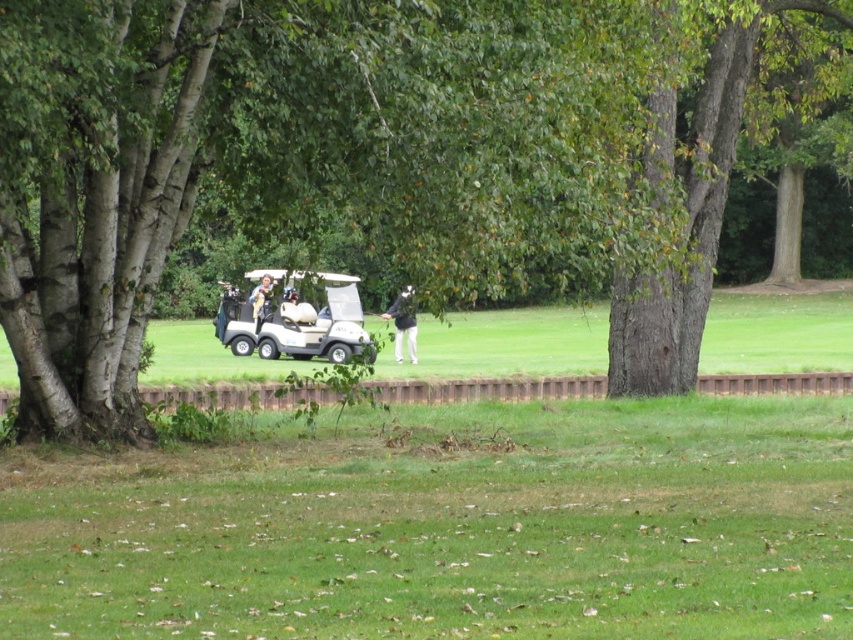
You are a golfer standing at the edge of the grassy area. You see the white matte golf cart at center and the dark gray pants at center. Which object is higher up in the image?

The white matte golf cart at center is located above the dark gray pants at center in the image.

You are a golfer who needs to retrieve your light brown leather jacket at center from the brown textured tree at center. The park has a rule that you can only walk 100 feet from your current position. Can you reach your jacket without violating the rule?

The brown textured tree at center and light brown leather jacket at center are 90.76 feet apart. Since 90.76 feet is less than 100 feet, you can retrieve the jacket without violating the park rule.

You see a brown textured tree at center and a light brown leather jacket at center in the image. Which object is positioned to the right side?

The brown textured tree at center is to the right of the light brown leather jacket at center.